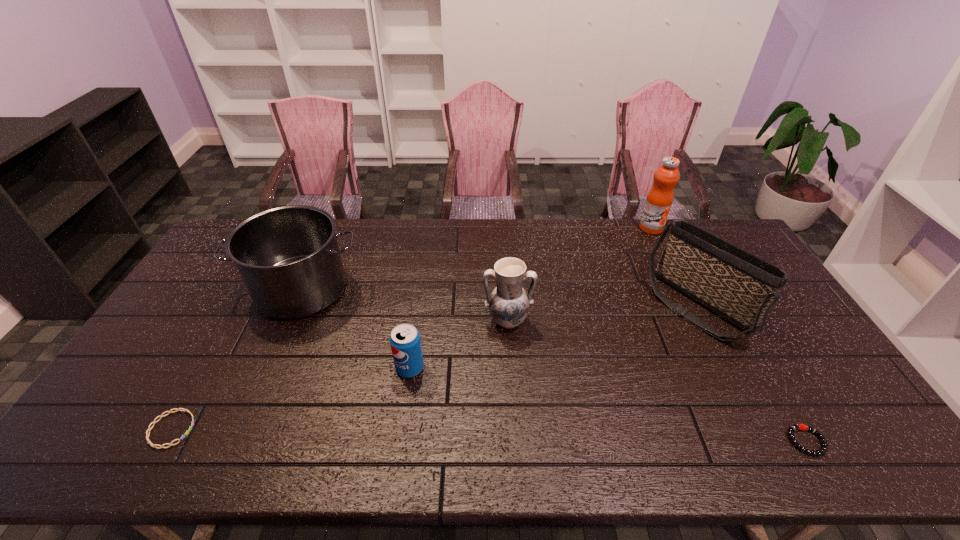
Locate an element on the screen. object that is at the near left corner is located at coordinates (185, 410).

Where is `object positioned at the near right corner`? The image size is (960, 540). object positioned at the near right corner is located at coordinates (794, 427).

The image size is (960, 540). I want to click on vacant region at the far edge, so click(426, 258).

What are the coordinates of `vacant region at the near edge` in the screenshot? It's located at 239,449.

You are a GUI agent. You are given a task and a screenshot of the screen. Output one action in this format:
    pyautogui.click(x=<x>, y=<y>)
    Task: Click on the vacant space at the left edge of the desktop
    The width and height of the screenshot is (960, 540).
    Given the screenshot: What is the action you would take?
    219,267

In order to click on vacant point located between the left bracelet and the saucepan in this screenshot , I will do `click(237, 359)`.

Find the location of a particular element. The width and height of the screenshot is (960, 540). vacant area that lies between the fruit juice and the pottery is located at coordinates (579, 274).

The width and height of the screenshot is (960, 540). In order to click on vacant space in between the farthest object and the pottery in this screenshot , I will do `click(579, 274)`.

Locate an element on the screen. vacant point located between the fourth object from left to right and the left bracelet is located at coordinates (340, 375).

I want to click on free point between the right bracelet and the handbag, so click(x=753, y=374).